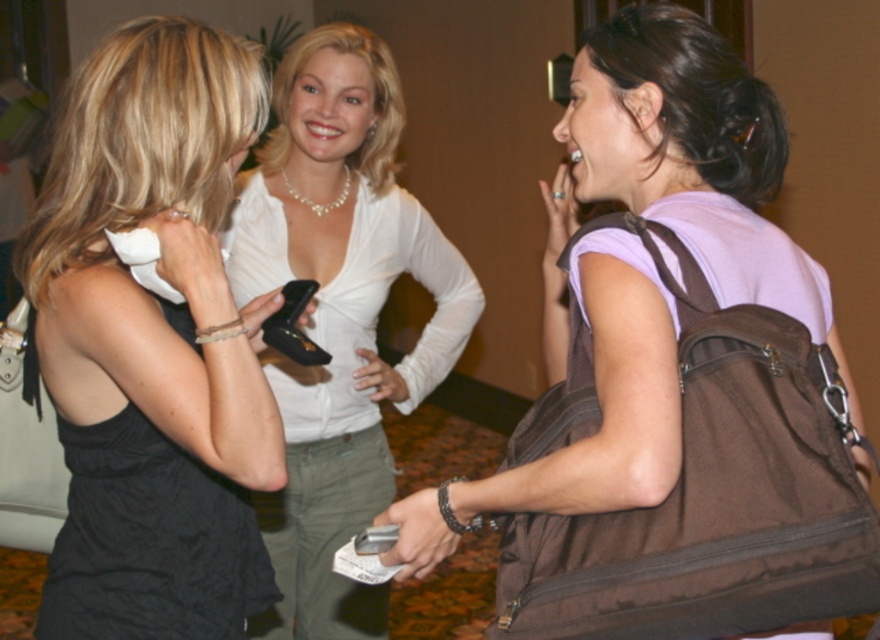
Between brown fabric backpack at right and metallic silver phone at center, which one appears on the right side from the viewer's perspective?

From the viewer's perspective, brown fabric backpack at right appears more on the right side.

Looking at this image, is brown fabric backpack at right smaller than metallic silver phone at center?

Actually, brown fabric backpack at right might be larger than metallic silver phone at center.

Between point (638, 300) and point (354, 540), which one is positioned in front?

Positioned in front is point (638, 300).

This screenshot has height=640, width=880. Find the location of `brown fabric backpack at right`. brown fabric backpack at right is located at coordinates (642, 266).

Is black satin dress at left positioned before black rubber smartphone at center?

Yes, black satin dress at left is closer to the viewer.

Is point (67, 288) less distant than point (325, 356)?

Yes.

You are a GUI agent. You are given a task and a screenshot of the screen. Output one action in this format:
    pyautogui.click(x=<x>, y=<y>)
    Task: Click on the black satin dress at left
    
    Given the screenshot: What is the action you would take?
    pyautogui.click(x=152, y=342)

Can you confirm if brown fabric backpack at right is positioned to the right of white satin blouse at center?

Indeed, brown fabric backpack at right is positioned on the right side of white satin blouse at center.

Between point (627, 88) and point (370, 353), which one is positioned in front?

Point (627, 88) is more forward.

The height and width of the screenshot is (640, 880). Identify the location of brown fabric backpack at right. (642, 266).